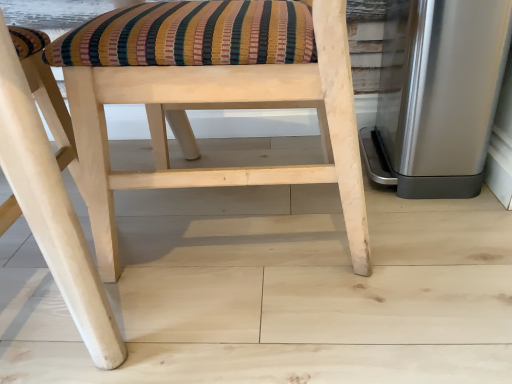
Question: In which direction should I rotate to look at natural wood chair at center, which ranks as the second chair in left-to-right order?

Choices:
 (A) right
 (B) left

Answer: (B)

Question: Is the depth of natural wood chair at center, which ranks as the second chair in left-to-right order, greater than that of satin silver trash can at right?

Choices:
 (A) no
 (B) yes

Answer: (A)

Question: From the image's perspective, would you say natural wood chair at center, which appears as the 1th chair when viewed from the right, is positioned over satin silver trash can at right?

Choices:
 (A) no
 (B) yes

Answer: (A)

Question: From a real-world perspective, is natural wood chair at center, which appears as the 1th chair when viewed from the right, located beneath satin silver trash can at right?

Choices:
 (A) yes
 (B) no

Answer: (B)

Question: Is natural wood chair at center, which ranks as the second chair in left-to-right order, taller than satin silver trash can at right?

Choices:
 (A) no
 (B) yes

Answer: (B)

Question: Is satin silver trash can at right located within natural wood chair at center, which ranks as the second chair in left-to-right order?

Choices:
 (A) yes
 (B) no

Answer: (B)

Question: Is natural wood chair at center, which ranks as the second chair in left-to-right order, bigger than satin silver trash can at right?

Choices:
 (A) yes
 (B) no

Answer: (A)

Question: Is natural wood chair at center, which appears as the 1th chair when viewed from the right, bigger than natural wood chair at center, the 2th chair from the right?

Choices:
 (A) yes
 (B) no

Answer: (B)

Question: Can you confirm if natural wood chair at center, which appears as the 1th chair when viewed from the right, is smaller than natural wood chair at center, which appears as the 1th chair when viewed from the left?

Choices:
 (A) no
 (B) yes

Answer: (B)

Question: Does natural wood chair at center, which ranks as the second chair in left-to-right order, appear on the right side of natural wood chair at center, which appears as the 1th chair when viewed from the left?

Choices:
 (A) no
 (B) yes

Answer: (B)

Question: Is natural wood chair at center, which ranks as the second chair in left-to-right order, touching natural wood chair at center, the 2th chair from the right?

Choices:
 (A) yes
 (B) no

Answer: (B)

Question: Can natural wood chair at center, the 2th chair from the right, be found inside natural wood chair at center, which appears as the 1th chair when viewed from the right?

Choices:
 (A) yes
 (B) no

Answer: (B)

Question: Considering the relative positions of natural wood chair at center, which ranks as the second chair in left-to-right order, and natural wood chair at center, which appears as the 1th chair when viewed from the left, in the image provided, is natural wood chair at center, which ranks as the second chair in left-to-right order, behind natural wood chair at center, which appears as the 1th chair when viewed from the left,?

Choices:
 (A) yes
 (B) no

Answer: (A)

Question: Does natural wood chair at center, which appears as the 1th chair when viewed from the left, appear on the right side of natural wood chair at center, which appears as the 1th chair when viewed from the right?

Choices:
 (A) no
 (B) yes

Answer: (A)